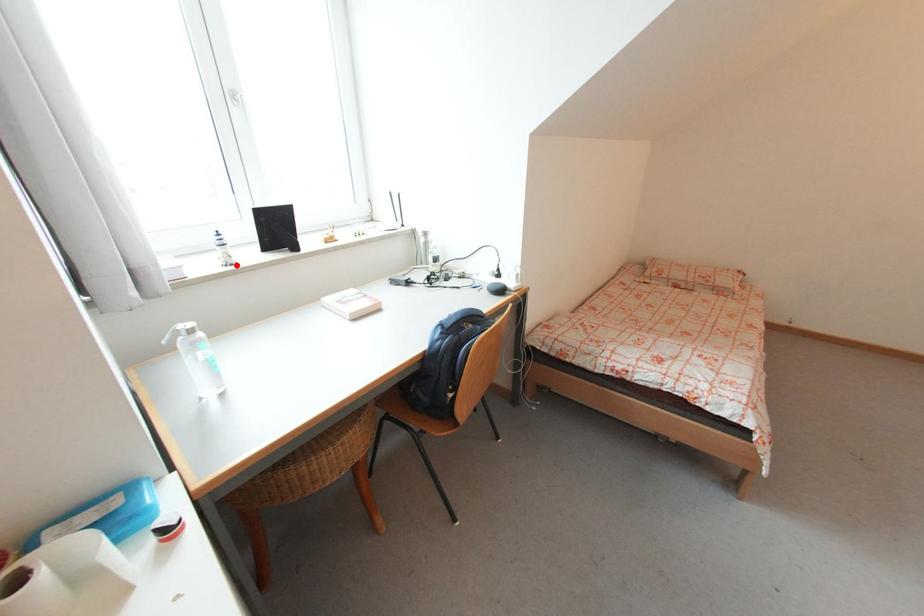
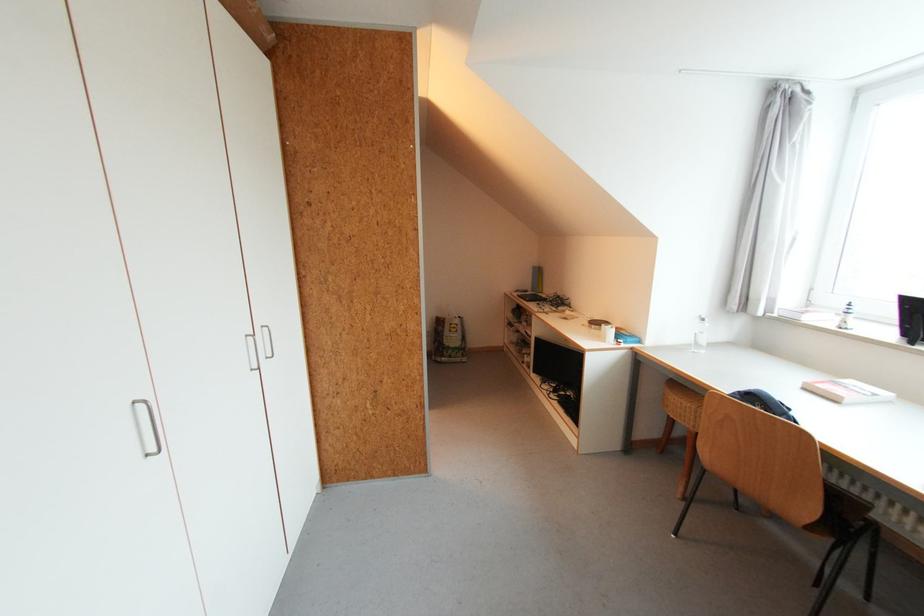
Locate, in the second image, the point that corresponds to the highlighted location in the first image.

(845, 329)